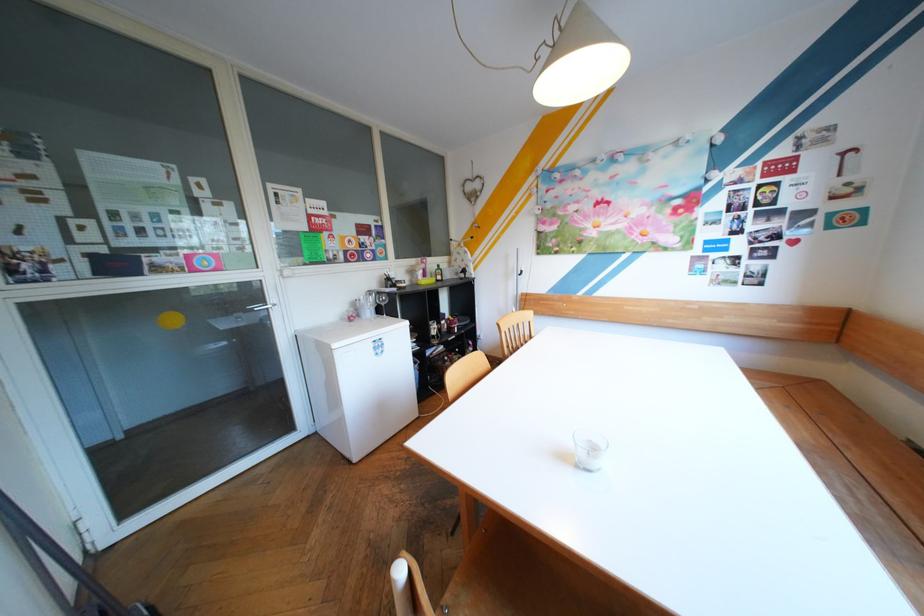
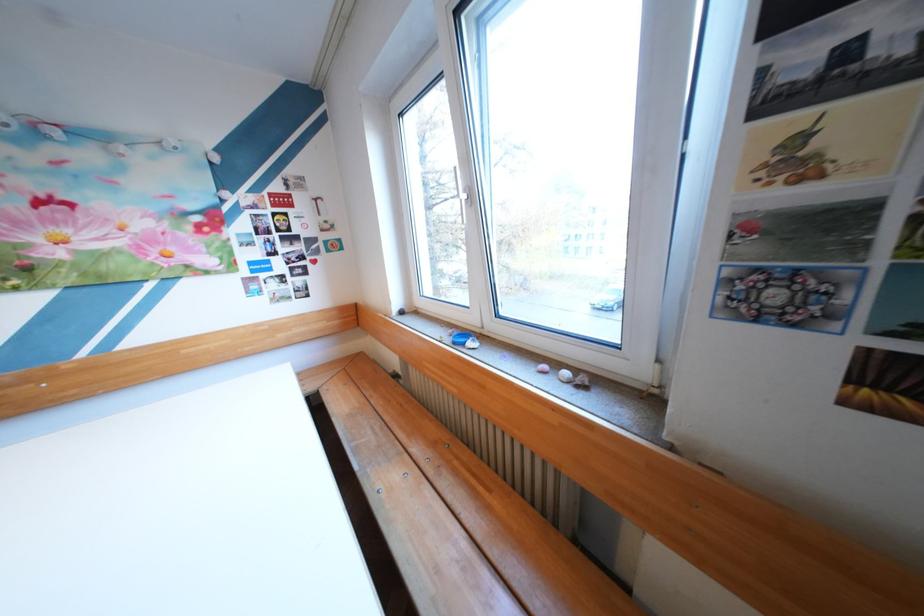
Question: The camera is either moving clockwise (left) or counter-clockwise (right) around the object. The first image is from the beginning of the video and the second image is from the end. Is the camera moving left or right when shooting the video?

Choices:
 (A) Left
 (B) Right

Answer: (A)